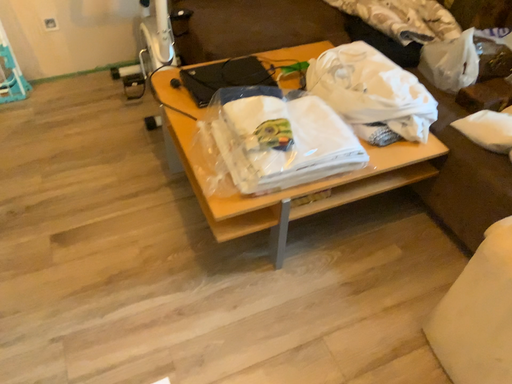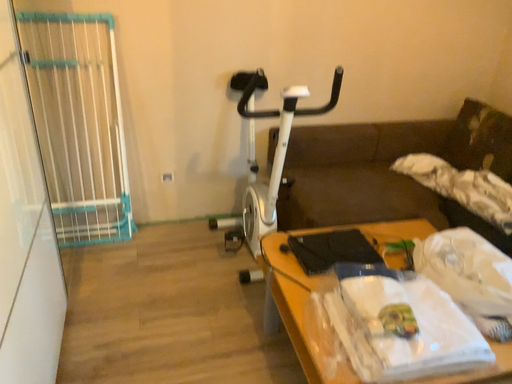
Question: Which way did the camera rotate in the video?

Choices:
 (A) rotated downward
 (B) rotated upward

Answer: (B)